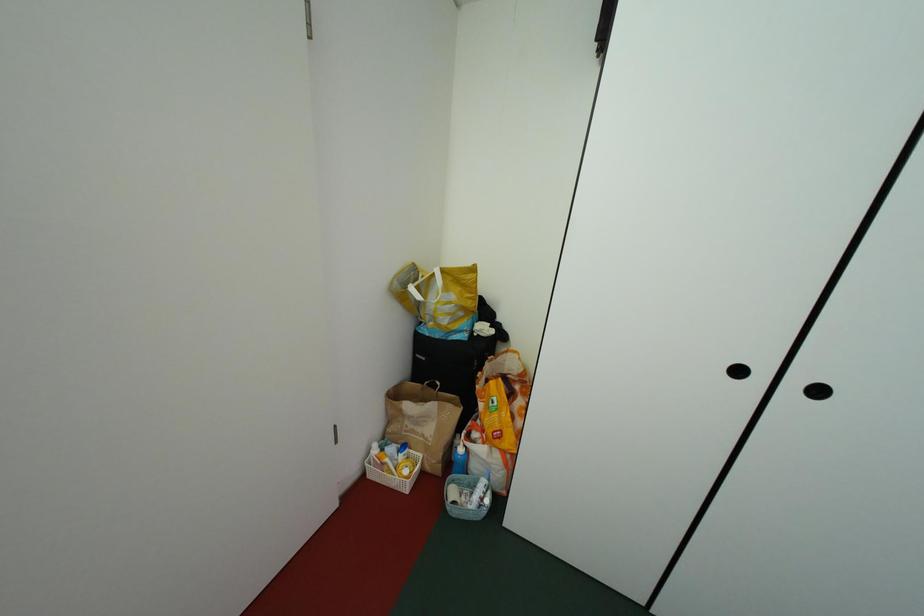
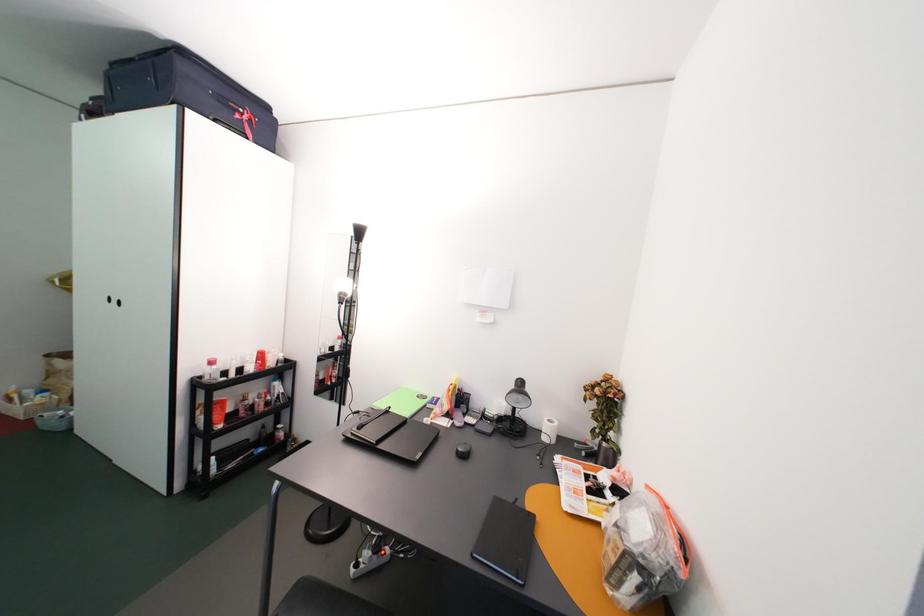
The images are taken continuously from a first-person perspective. In which direction are you moving?

The cameraman moved toward right, backward.